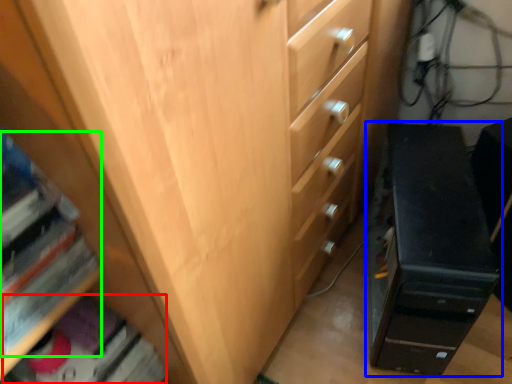
Question: Which object is the closest to the book (highlighted by a red box)? Choose among these: chest of drawers (highlighted by a blue box) or book (highlighted by a green box).

Choices:
 (A) chest of drawers
 (B) book

Answer: (B)